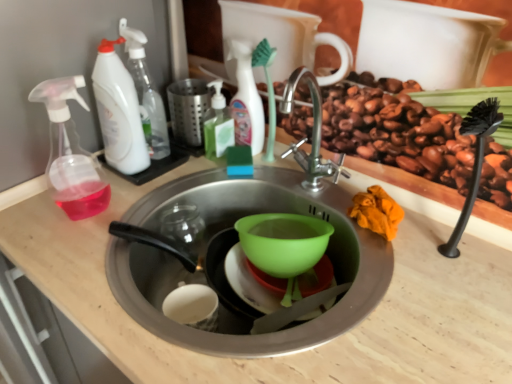
Locate an element on the screen. The width and height of the screenshot is (512, 384). vacant space in front of transparent plastic spray bottle at left is located at coordinates (75, 258).